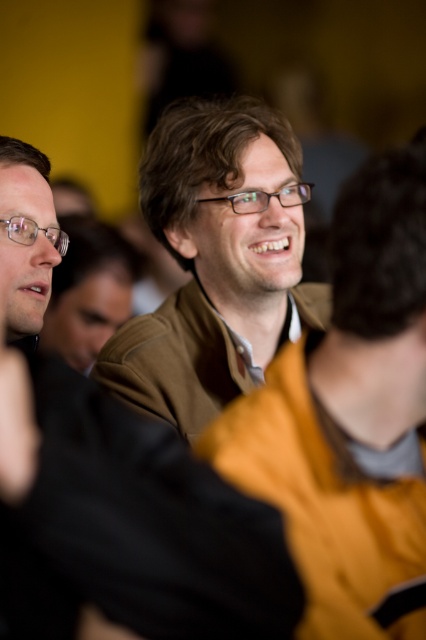
You are a fashion designer trying to decide which jacket to add to your collection. You have two jackets in front of you, the brown leather jacket at center and the matte brown jacket at center. Based on their thickness, which one would be more suitable for a summer collection?

The brown leather jacket at center is thinner than the matte brown jacket at center, so it would be more suitable for a summer collection as thinner jackets are typically more comfortable in warmer weather.

You are a photographer trying to capture a closeup of the central man without making the other jacket in the frame. Given the current setup, can you adjust the camera to focus only on the brown leather jacket at center while keeping the matte brown jacket at center out of focus?

The distance between brown leather jacket at center and matte brown jacket at center is 50.96 centimeters. With this separation, adjusting the camera focus to the brown leather jacket at center while keeping the matte brown jacket at center out of focus is feasible, as the distance allows for a shallow depth of field effect.